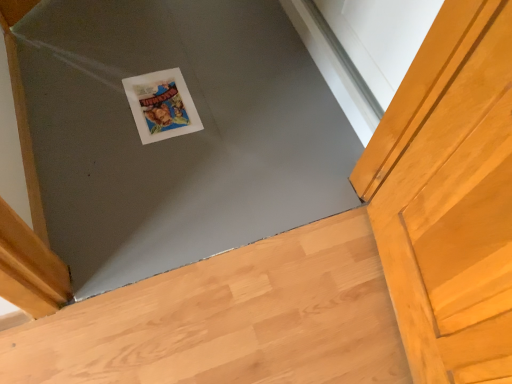
Find the location of `vacant area on top of natural wood plywood at center (from a real-world perspective)`. vacant area on top of natural wood plywood at center (from a real-world perspective) is located at coordinates (261, 310).